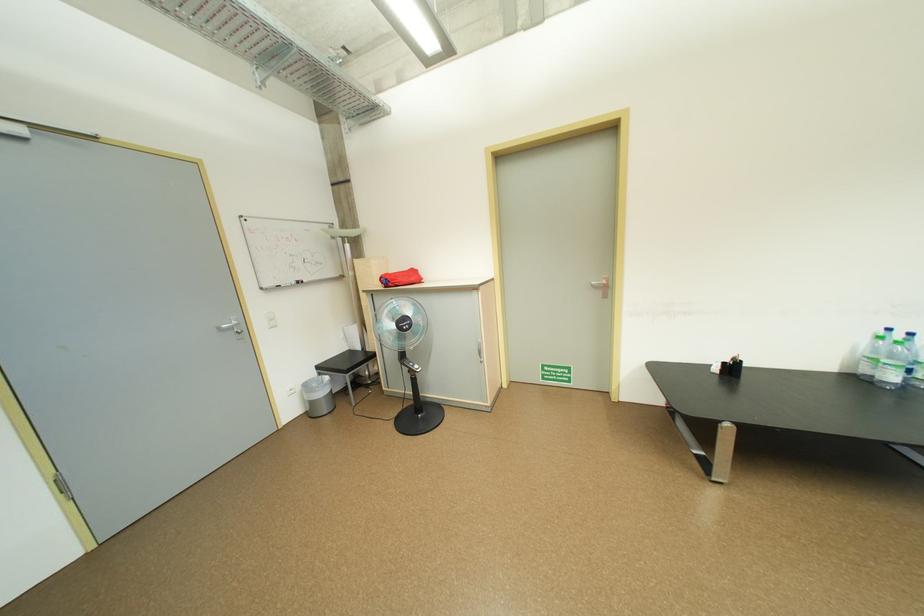
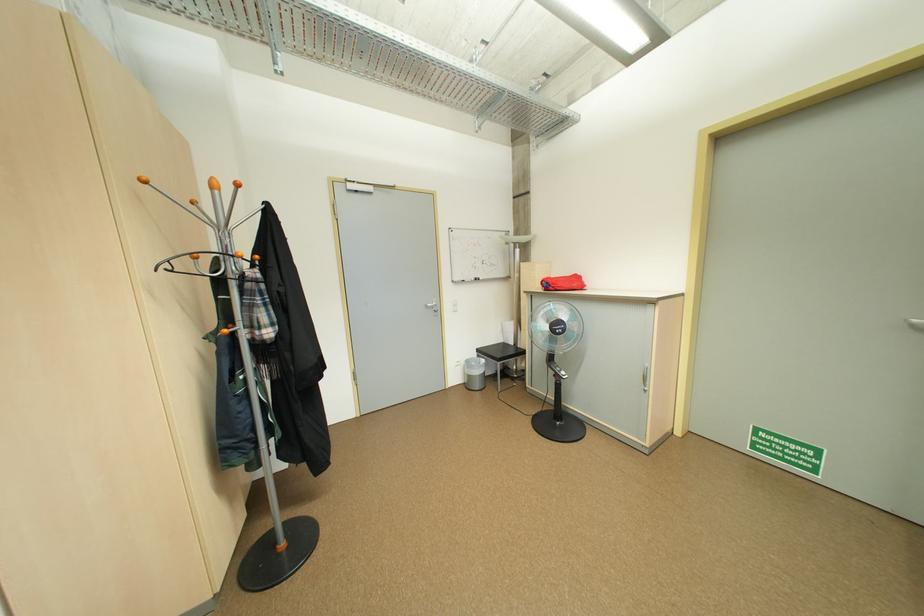
Locate, in the second image, the point that corresponds to the point at 419,371 in the first image.

(565, 377)